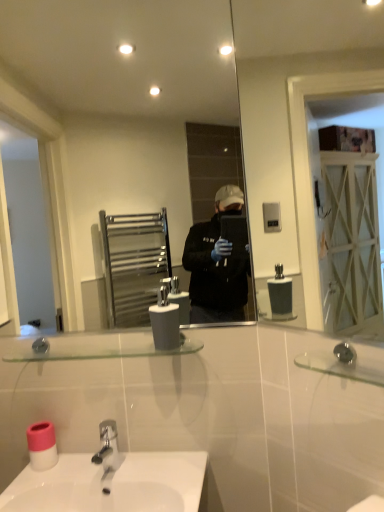
This screenshot has height=512, width=384. What are the coordinates of `white matte soap dispenser at center` in the screenshot? It's located at (165, 322).

From the picture: Measure the distance between point (165, 310) and camera.

The depth of point (165, 310) is 3.74 feet.

Describe the element at coordinates (121, 123) in the screenshot. The image size is (384, 512). I see `clear glass mirror at center, positioned as the first mirror in back-to-front order` at that location.

Consider the image. Measure the distance between clear glass mirror at center, acting as the 2th mirror starting from the right, and camera.

clear glass mirror at center, acting as the 2th mirror starting from the right, is 1.42 meters away from camera.

This screenshot has height=512, width=384. Describe the element at coordinates (100, 352) in the screenshot. I see `clear glass shelf at center` at that location.

Identify the location of clear glass mirror at upper right, placed as the 1th mirror when sorted from right to left. This screenshot has width=384, height=512. (292, 151).

Which of these two, clear glass mirror at center, acting as the 2th mirror starting from the right, or pink plastic toilet paper at lower left, is smaller?

pink plastic toilet paper at lower left is smaller.

Between clear glass mirror at center, the 1th mirror positioned from the left, and pink plastic toilet paper at lower left, which one is positioned in front?

clear glass mirror at center, the 1th mirror positioned from the left, is more forward.

From the image's perspective, which one is positioned lower, clear glass mirror at center, positioned as the first mirror in back-to-front order, or pink plastic toilet paper at lower left?

From the image's view, pink plastic toilet paper at lower left is below.

Is clear glass mirror at center, the 1th mirror positioned from the left, aimed at clear glass mirror at upper right, the 2th mirror in the left-to-right sequence?

No.

From a real-world perspective, which object stands above the other?

clear glass mirror at center, positioned as the first mirror in back-to-front order, is physically above.

From the image's perspective, between clear glass mirror at center, positioned as the first mirror in back-to-front order, and clear glass mirror at upper right, which is counted as the 1th mirror, starting from the front, which one is located above?

clear glass mirror at center, positioned as the first mirror in back-to-front order, appears higher in the image.

Looking at this image, is clear glass mirror at center, positioned as the first mirror in back-to-front order, positioned before clear glass mirror at upper right, positioned as the 2th mirror in back-to-front order?

That is False.

Is point (254, 175) more distant than point (62, 358)?

That is True.

Between clear glass mirror at upper right, the 2th mirror in the left-to-right sequence, and clear glass shelf at center, which one has smaller width?

Thinner between the two is clear glass mirror at upper right, the 2th mirror in the left-to-right sequence.

Does clear glass mirror at upper right, the 2th mirror in the left-to-right sequence, turn towards clear glass shelf at center?

No.

Is clear glass mirror at upper right, the 2th mirror in the left-to-right sequence, surrounding clear glass shelf at center?

No, clear glass shelf at center is not surrounded by clear glass mirror at upper right, the 2th mirror in the left-to-right sequence.

Consider the image. Is white matte soap dispenser at center a part of pink plastic toilet paper at lower left?

No, white matte soap dispenser at center is not a part of pink plastic toilet paper at lower left.

In the image, is pink plastic toilet paper at lower left on the left side or the right side of white matte soap dispenser at center?

In the image, pink plastic toilet paper at lower left appears on the left side of white matte soap dispenser at center.

From a real-world perspective, is pink plastic toilet paper at lower left on white matte soap dispenser at center?

No.

Can you confirm if pink plastic toilet paper at lower left is thinner than white matte soap dispenser at center?

In fact, pink plastic toilet paper at lower left might be wider than white matte soap dispenser at center.

Which object is further away from the camera taking this photo, clear glass shelf at center or pink plastic toilet paper at lower left?

pink plastic toilet paper at lower left.

Can you confirm if clear glass shelf at center is bigger than pink plastic toilet paper at lower left?

Yes, clear glass shelf at center is bigger than pink plastic toilet paper at lower left.

Is clear glass shelf at center positioned with its back to pink plastic toilet paper at lower left?

clear glass shelf at center is not turned away from pink plastic toilet paper at lower left.

From the image's perspective, is clear glass shelf at center over pink plastic toilet paper at lower left?

Yes, from the image's perspective, clear glass shelf at center is on top of pink plastic toilet paper at lower left.

Is clear glass mirror at upper right, placed as the 1th mirror when sorted from right to left, to the right of clear glass mirror at center, positioned as the first mirror in back-to-front order, from the viewer's perspective?

Yes.

Is clear glass mirror at upper right, placed as the 1th mirror when sorted from right to left, touching clear glass mirror at center, the 1th mirror positioned from the left?

There is a gap between clear glass mirror at upper right, placed as the 1th mirror when sorted from right to left, and clear glass mirror at center, the 1th mirror positioned from the left.

Is clear glass mirror at center, the 1th mirror positioned from the left, at the back of clear glass mirror at upper right, positioned as the 2th mirror in back-to-front order?

No, clear glass mirror at upper right, positioned as the 2th mirror in back-to-front order, is not facing the opposite direction of clear glass mirror at center, the 1th mirror positioned from the left.

Considering the sizes of objects pink plastic toilet paper at lower left and clear glass shelf at center in the image provided, who is thinner, pink plastic toilet paper at lower left or clear glass shelf at center?

With smaller width is pink plastic toilet paper at lower left.

Is pink plastic toilet paper at lower left facing towards clear glass shelf at center?

No, pink plastic toilet paper at lower left is not facing towards clear glass shelf at center.

How much distance is there between pink plastic toilet paper at lower left and clear glass shelf at center?

pink plastic toilet paper at lower left and clear glass shelf at center are 11.51 inches apart from each other.

Looking at the image, does pink plastic toilet paper at lower left seem bigger or smaller compared to clear glass shelf at center?

Considering their sizes, pink plastic toilet paper at lower left takes up less space than clear glass shelf at center.

What are the coordinates of `mirror that is the 1st one when counting rightward from the pink plastic toilet paper at lower left` in the screenshot? It's located at (121, 123).

Find the location of `mirror in front of the clear glass mirror at center, acting as the 2th mirror starting from the right`. mirror in front of the clear glass mirror at center, acting as the 2th mirror starting from the right is located at coordinates (292, 151).

Which object lies nearer to the anchor point clear glass mirror at upper right, placed as the 1th mirror when sorted from right to left, pink plastic toilet paper at lower left or white matte soap dispenser at center?

Among the two, white matte soap dispenser at center is located nearer to clear glass mirror at upper right, placed as the 1th mirror when sorted from right to left.

Looking at the image, which one is located further to white matte soap dispenser at center, clear glass shelf at center or pink plastic toilet paper at lower left?

pink plastic toilet paper at lower left.

Estimate the real-world distances between objects in this image. Which object is closer to clear glass mirror at center, the 1th mirror positioned from the left, clear glass shelf at center or white matte soap dispenser at center?

Based on the image, clear glass shelf at center appears to be nearer to clear glass mirror at center, the 1th mirror positioned from the left.

Which object lies nearer to the anchor point clear glass shelf at center, clear glass mirror at center, acting as the 2th mirror starting from the right, or clear glass mirror at upper right, positioned as the 2th mirror in back-to-front order?

Among the two, clear glass mirror at upper right, positioned as the 2th mirror in back-to-front order, is located nearer to clear glass shelf at center.

Based on their spatial positions, is white matte soap dispenser at center or clear glass mirror at center, which appears as the 2th mirror when viewed from the front, further from pink plastic toilet paper at lower left?

clear glass mirror at center, which appears as the 2th mirror when viewed from the front, lies further to pink plastic toilet paper at lower left than the other object.

From the image, which object appears to be nearer to clear glass mirror at center, acting as the 2th mirror starting from the right, pink plastic toilet paper at lower left or white matte soap dispenser at center?

white matte soap dispenser at center lies closer to clear glass mirror at center, acting as the 2th mirror starting from the right, than the other object.

When comparing their distances from clear glass mirror at center, which appears as the 2th mirror when viewed from the front, does white matte soap dispenser at center or pink plastic toilet paper at lower left seem further?

The object further to clear glass mirror at center, which appears as the 2th mirror when viewed from the front, is pink plastic toilet paper at lower left.

Estimate the real-world distances between objects in this image. Which object is closer to clear glass mirror at center, positioned as the first mirror in back-to-front order, pink plastic toilet paper at lower left or clear glass mirror at upper right, the 2th mirror in the left-to-right sequence?

clear glass mirror at upper right, the 2th mirror in the left-to-right sequence.

Image resolution: width=384 pixels, height=512 pixels. In order to click on soap dispenser between clear glass mirror at upper right, the 2th mirror in the left-to-right sequence, and clear glass shelf at center in the up-down direction in this screenshot , I will do `click(165, 322)`.

Find the location of a particular element. This screenshot has width=384, height=512. balustrade between white matte soap dispenser at center and pink plastic toilet paper at lower left in the vertical direction is located at coordinates (100, 352).

Find the location of a particular element. soap dispenser between clear glass mirror at center, positioned as the first mirror in back-to-front order, and clear glass mirror at upper right, the 2th mirror in the left-to-right sequence is located at coordinates (165, 322).

The width and height of the screenshot is (384, 512). Identify the location of soap dispenser between clear glass mirror at center, acting as the 2th mirror starting from the right, and clear glass shelf at center, in the vertical direction. (165, 322).